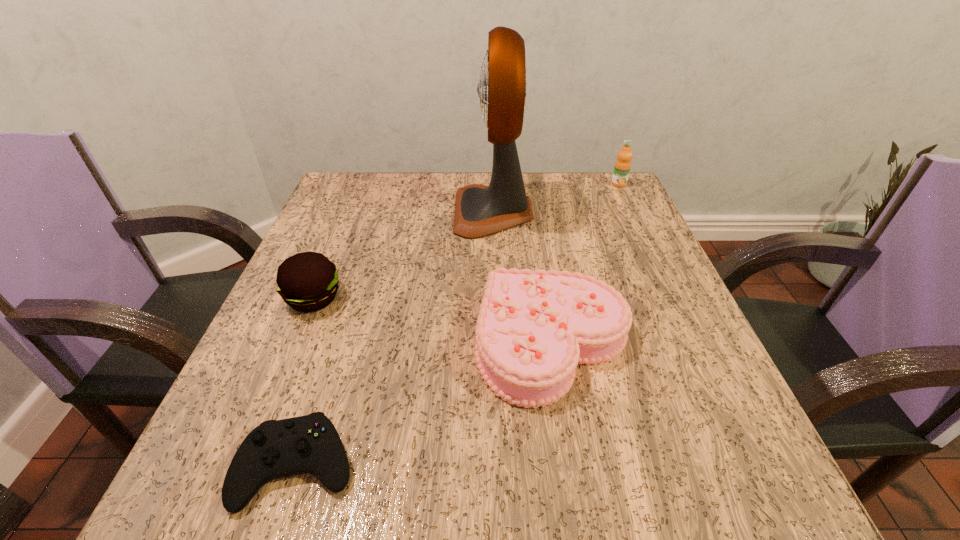
Image resolution: width=960 pixels, height=540 pixels. What are the coordinates of `orange juice that is at the right edge` in the screenshot? It's located at (622, 167).

Where is `cake situated at the right edge`? The width and height of the screenshot is (960, 540). cake situated at the right edge is located at coordinates (533, 328).

This screenshot has height=540, width=960. I want to click on object positioned at the near left corner, so click(275, 449).

Locate an element on the screen. Image resolution: width=960 pixels, height=540 pixels. object at the far right corner is located at coordinates (622, 167).

In the image, there is a desktop. Identify the location of vacant area at the far edge. (548, 178).

At what (x,y) coordinates should I click in order to perform the action: click on free region at the near edge of the desktop. Please return your answer as a coordinate pair (x, y). This screenshot has height=540, width=960. Looking at the image, I should click on (478, 455).

In the image, there is a desktop. Identify the location of free space at the left edge. (360, 320).

At what (x,y) coordinates should I click in order to perform the action: click on vacant space at the right edge of the desktop. Please return your answer as a coordinate pair (x, y). This screenshot has height=540, width=960. Looking at the image, I should click on pos(735,410).

Identify the location of vacant space at the far left corner of the desktop. (x=372, y=185).

Image resolution: width=960 pixels, height=540 pixels. I want to click on vacant space at the near left corner of the desktop, so click(195, 487).